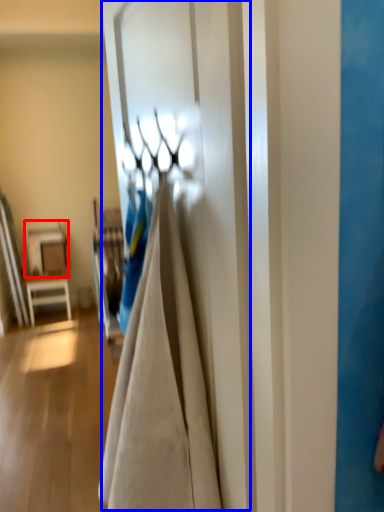
Question: Among these objects, which one is farthest to the camera, table (highlighted by a red box) or door (highlighted by a blue box)?

Choices:
 (A) table
 (B) door

Answer: (A)